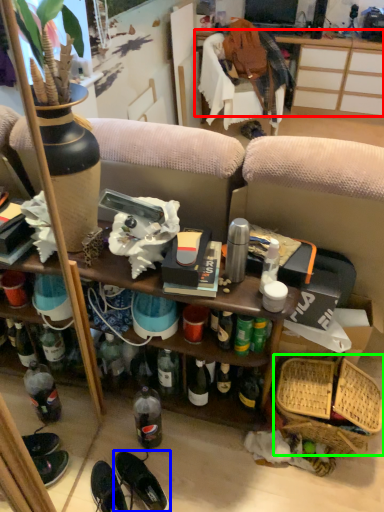
Question: Which object is the farthest from desk (highlighted by a red box)? Choose among these: footwear (highlighted by a blue box) or basket (highlighted by a green box).

Choices:
 (A) footwear
 (B) basket

Answer: (A)